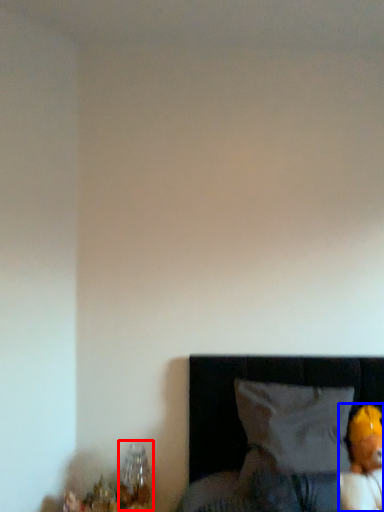
Question: Which of the following is the closest to the observer, table lamp (highlighted by a red box) or toy (highlighted by a blue box)?

Choices:
 (A) table lamp
 (B) toy

Answer: (B)